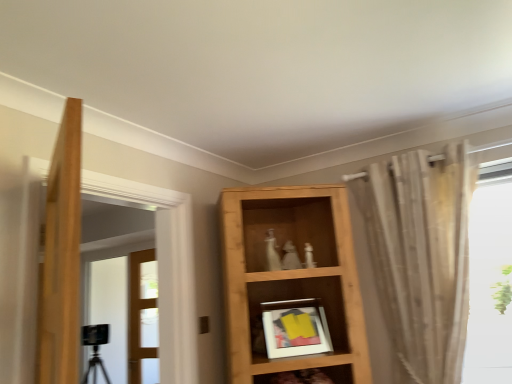
Question: Considering the relative positions of clear glass door at center, marked as the 2th door in a left-to-right arrangement, and black glass door at left, positioned as the 1th door in left-to-right order, in the image provided, is clear glass door at center, marked as the 2th door in a left-to-right arrangement, in front of black glass door at left, positioned as the 1th door in left-to-right order,?

Choices:
 (A) yes
 (B) no

Answer: (B)

Question: Is clear glass door at center, marked as the 2th door in a left-to-right arrangement, facing away from black glass door at left, positioned as the 2th door in right-to-left order?

Choices:
 (A) no
 (B) yes

Answer: (B)

Question: Considering the relative sizes of clear glass door at center, marked as the 2th door in a left-to-right arrangement, and black glass door at left, positioned as the 2th door in right-to-left order, in the image provided, is clear glass door at center, marked as the 2th door in a left-to-right arrangement, thinner than black glass door at left, positioned as the 2th door in right-to-left order,?

Choices:
 (A) no
 (B) yes

Answer: (B)

Question: Can we say clear glass door at center, the first door positioned from the right, lies outside black glass door at left, positioned as the 1th door in left-to-right order?

Choices:
 (A) no
 (B) yes

Answer: (A)

Question: Can you confirm if clear glass door at center, marked as the 2th door in a left-to-right arrangement, is smaller than black glass door at left, positioned as the 1th door in left-to-right order?

Choices:
 (A) no
 (B) yes

Answer: (B)

Question: Is clear glass door at center, marked as the 2th door in a left-to-right arrangement, bigger than black glass door at left, positioned as the 2th door in right-to-left order?

Choices:
 (A) yes
 (B) no

Answer: (B)

Question: Is sheer beige curtain at right shorter than wooden shelf at lower center, which is the second shelf in top-to-bottom order?

Choices:
 (A) yes
 (B) no

Answer: (B)

Question: Is the depth of sheer beige curtain at right greater than that of wooden shelf at lower center, acting as the first shelf starting from the bottom?

Choices:
 (A) yes
 (B) no

Answer: (B)

Question: Is sheer beige curtain at right at the left side of wooden shelf at lower center, which is the second shelf in top-to-bottom order?

Choices:
 (A) yes
 (B) no

Answer: (B)

Question: Does sheer beige curtain at right have a smaller size compared to wooden shelf at lower center, which is the second shelf in top-to-bottom order?

Choices:
 (A) yes
 (B) no

Answer: (B)

Question: Is sheer beige curtain at right closer to camera compared to wooden shelf at lower center, which is the second shelf in top-to-bottom order?

Choices:
 (A) no
 (B) yes

Answer: (B)

Question: From the image's perspective, does sheer beige curtain at right appear lower than wooden shelf at lower center, which is the second shelf in top-to-bottom order?

Choices:
 (A) yes
 (B) no

Answer: (B)

Question: Is black glass door at left, positioned as the 2th door in right-to-left order, next to sheer beige curtain at right?

Choices:
 (A) no
 (B) yes

Answer: (A)